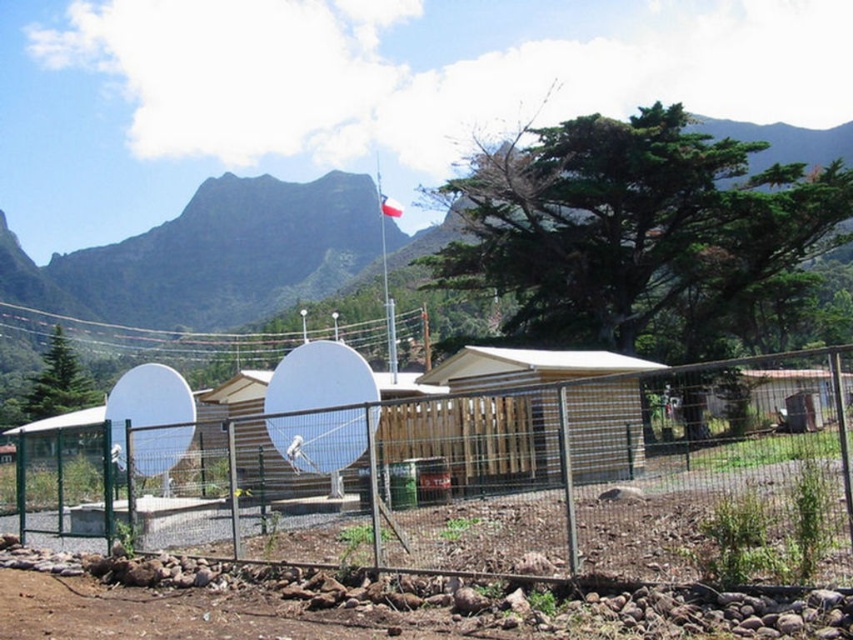
Which is above, white plastic flagpole at center or white fabric flag at upper center?

white fabric flag at upper center

Does white plastic flagpole at center appear on the left side of white fabric flag at upper center?

Indeed, white plastic flagpole at center is positioned on the left side of white fabric flag at upper center.

Is point (380, 237) less distant than point (381, 196)?

That is False.

Find the location of a particular element. The height and width of the screenshot is (640, 853). white plastic flagpole at center is located at coordinates (x=386, y=269).

Who is taller, green grassy mountain at upper center or white fabric flag at upper center?

green grassy mountain at upper center is taller.

Between point (344, 224) and point (393, 212), which one is positioned in front?

Point (393, 212) is more forward.

Is point (9, 388) positioned after point (389, 209)?

That is True.

At what (x,y) coordinates should I click in order to perform the action: click on green grassy mountain at upper center. Please return your answer as a coordinate pair (x, y). The width and height of the screenshot is (853, 640). Looking at the image, I should click on (212, 257).

Which is in front, point (422, 570) or point (262, 428)?

Point (422, 570) is more forward.

Is green wire mesh fence at center behind white matte satellite dish at center?

No, it is in front of white matte satellite dish at center.

Measure the distance between green wire mesh fence at center and camera.

A distance of 6.26 meters exists between green wire mesh fence at center and camera.

The width and height of the screenshot is (853, 640). I want to click on green wire mesh fence at center, so click(502, 477).